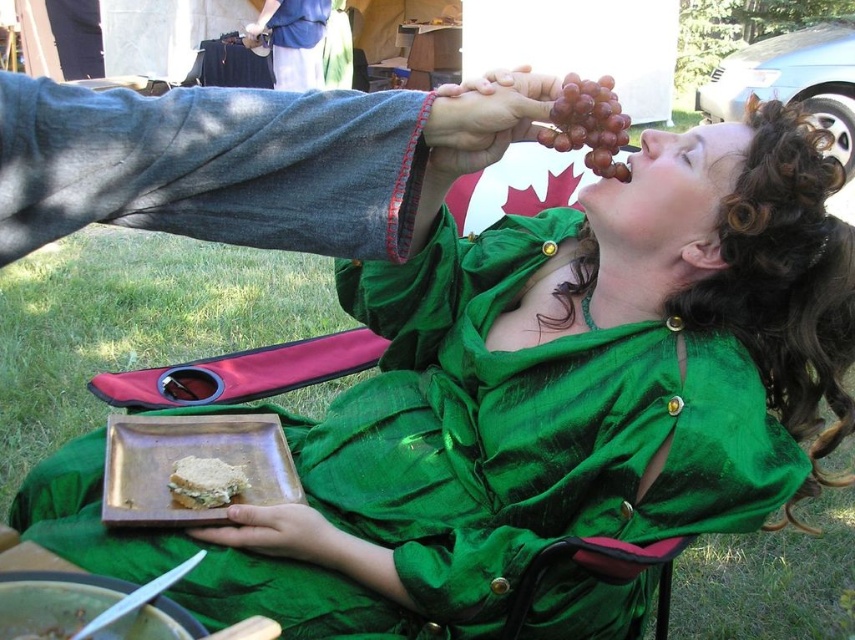
Can you confirm if ripe purple grapes at upper center is shorter than crumbly white bread at lower left?

In fact, ripe purple grapes at upper center may be taller than crumbly white bread at lower left.

Is ripe purple grapes at upper center positioned before crumbly white bread at lower left?

That is True.

Where is `ripe purple grapes at upper center`? The height and width of the screenshot is (640, 855). ripe purple grapes at upper center is located at coordinates (588, 124).